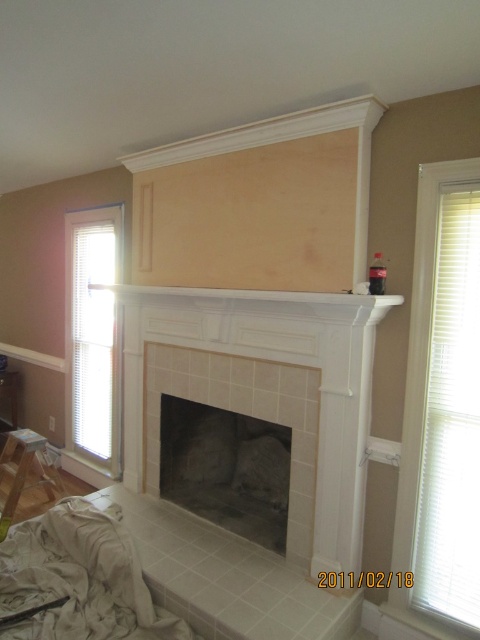
Is white tile fireplace at center taller than gray stone fireplace at center?

Indeed, white tile fireplace at center has a greater height compared to gray stone fireplace at center.

This screenshot has height=640, width=480. What do you see at coordinates (269, 369) in the screenshot?
I see `white tile fireplace at center` at bounding box center [269, 369].

Describe the element at coordinates (269, 369) in the screenshot. I see `white tile fireplace at center` at that location.

Where is `white tile fireplace at center`? Image resolution: width=480 pixels, height=640 pixels. white tile fireplace at center is located at coordinates (269, 369).

Does white tile fireplace at center have a lesser width compared to white blinds at right?

Incorrect, white tile fireplace at center's width is not less than white blinds at right's.

Is point (186, 291) positioned in front of point (468, 168)?

That is False.

Where is `white tile fireplace at center`? This screenshot has height=640, width=480. white tile fireplace at center is located at coordinates (269, 369).

Does white blinds at right come in front of gray stone fireplace at center?

That is True.

How distant is white blinds at right from gray stone fireplace at center?

A distance of 1.09 meters exists between white blinds at right and gray stone fireplace at center.

Where is `white blinds at right`? This screenshot has height=640, width=480. white blinds at right is located at coordinates (443, 397).